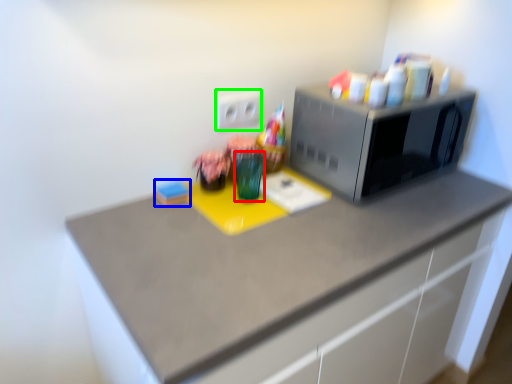
Question: Based on their relative distances, which object is nearer to glass vase (highlighted by a red box)? Choose from stationery (highlighted by a blue box) and electric outlet (highlighted by a green box).

Choices:
 (A) stationery
 (B) electric outlet

Answer: (B)